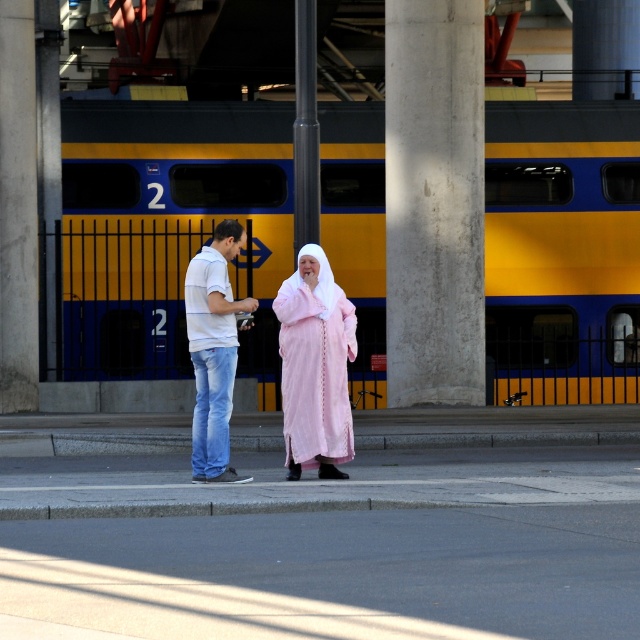
What do you see at coordinates (316, 365) in the screenshot? The height and width of the screenshot is (640, 640). I see `matte pink robe at center` at bounding box center [316, 365].

Is point (353, 356) in front of point (193, 324)?

That is False.

Identify the location of matte pink robe at center. (316, 365).

What do you see at coordinates (212, 349) in the screenshot?
I see `pink satin dress at center` at bounding box center [212, 349].

Which is behind, point (305, 353) or point (221, 392)?

Point (305, 353)

Between point (218, 289) and point (216, 316), which one is positioned behind?

Point (216, 316)

What are the coordinates of `pink satin dress at center` in the screenshot? It's located at (212, 349).

Is yellowmetallictrain at center further to camera compared to matte pink robe at center?

Yes.

Find the location of `yellowmetallictrain at center`. yellowmetallictrain at center is located at coordinates (168, 228).

Is point (342, 212) positioned before point (292, 282)?

That is False.

The image size is (640, 640). In order to click on yellowmetallictrain at center in this screenshot , I will do `click(168, 228)`.